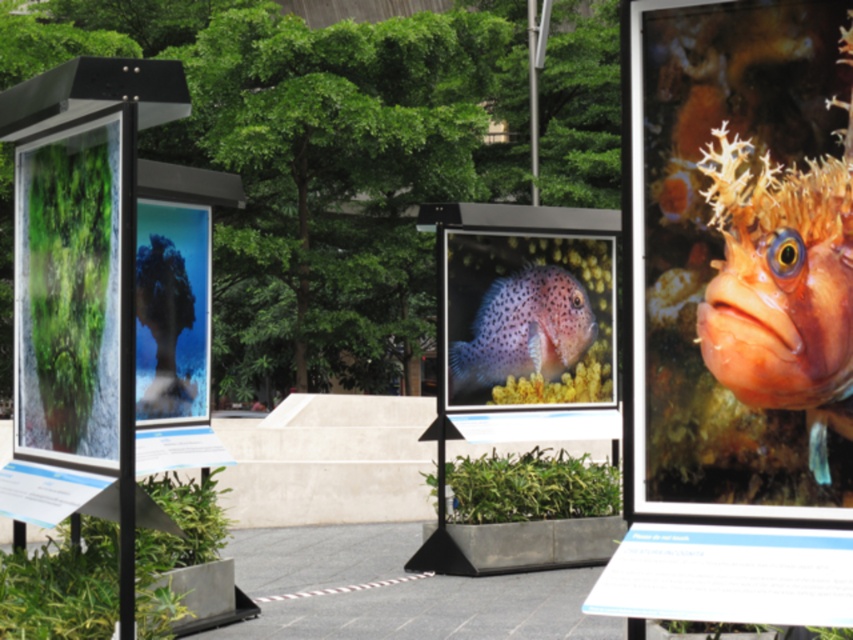
Which is above, orange textured fish at right or transparent glass coral at center?

orange textured fish at right is higher up.

Who is taller, orange textured fish at right or transparent glass coral at center?

Standing taller between the two is orange textured fish at right.

The width and height of the screenshot is (853, 640). Find the location of `orange textured fish at right`. orange textured fish at right is located at coordinates (741, 259).

Can you confirm if matte plastic fish at center is smaller than transparent glass panels at left?

Actually, matte plastic fish at center might be larger than transparent glass panels at left.

Which is above, matte plastic fish at center or transparent glass panels at left?

transparent glass panels at left is higher up.

Does point (480, 321) lie behind point (10, 122)?

Yes, point (480, 321) is farther from viewer.

I want to click on matte plastic fish at center, so pyautogui.click(x=526, y=323).

Does orange textured fish at right have a smaller size compared to spotted orange fish at center?

Correct, orange textured fish at right occupies less space than spotted orange fish at center.

Who is more distant from viewer, (772, 154) or (548, 365)?

The point (548, 365) is more distant.

The image size is (853, 640). I want to click on orange textured fish at right, so click(x=741, y=259).